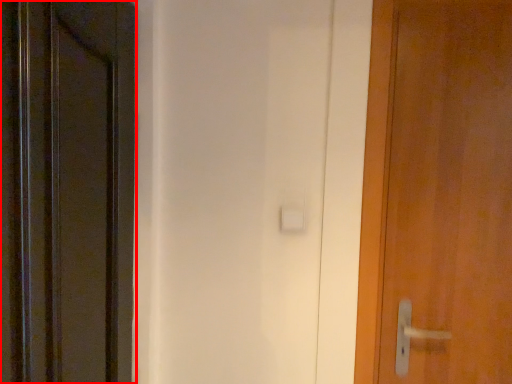
Question: From the image's perspective, considering the relative positions of door (annotated by the red box) and door in the image provided, where is door (annotated by the red box) located with respect to the staircase?

Choices:
 (A) below
 (B) above

Answer: (A)